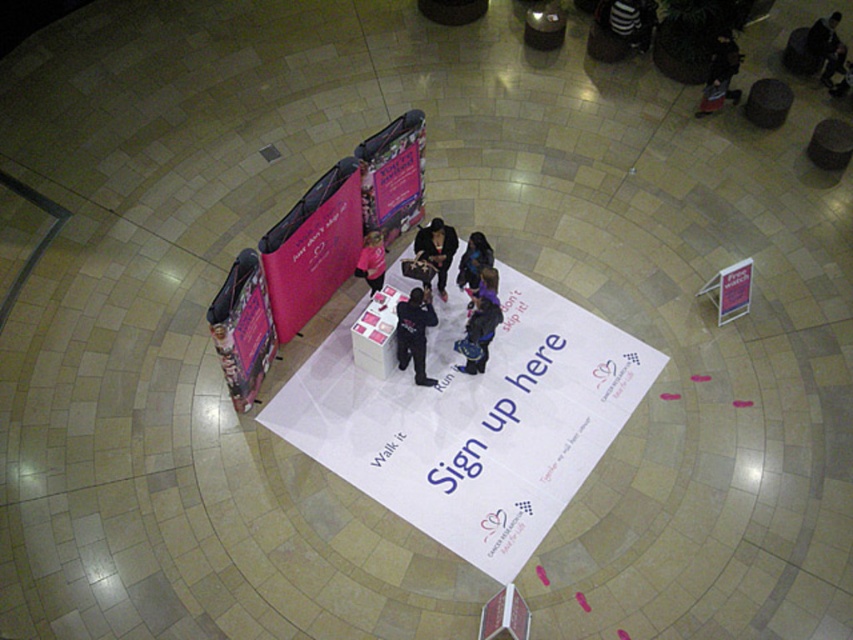
You are standing at the point with coordinates (436, 250) in the image. What object are you currently standing on?

You are standing on the black leather jacket at center.